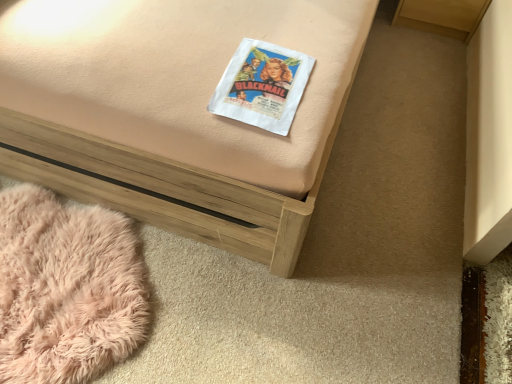
Question: Is wooden bed frame at center to the left or to the right of matte paper book at center in the image?

Choices:
 (A) right
 (B) left

Answer: (B)

Question: Considering the positions of wooden bed frame at center and matte paper book at center in the image, is wooden bed frame at center wider or thinner than matte paper book at center?

Choices:
 (A) wide
 (B) thin

Answer: (A)

Question: Considering the real-world distances, which object is farthest from the wooden bed frame at center?

Choices:
 (A) matte paper book at center
 (B) fluffy pink rug at lower left

Answer: (B)

Question: Estimate the real-world distances between objects in this image. Which object is closer to the fluffy pink rug at lower left?

Choices:
 (A) matte paper book at center
 (B) wooden bed frame at center

Answer: (B)